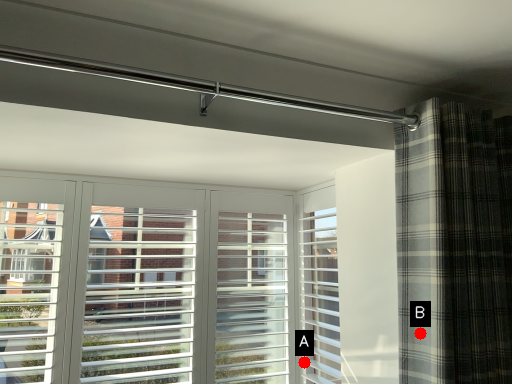
Question: Two points are circled on the image, labeled by A and B beside each circle. Among these points, which one is nearest to the camera?

Choices:
 (A) A is closer
 (B) B is closer

Answer: (B)